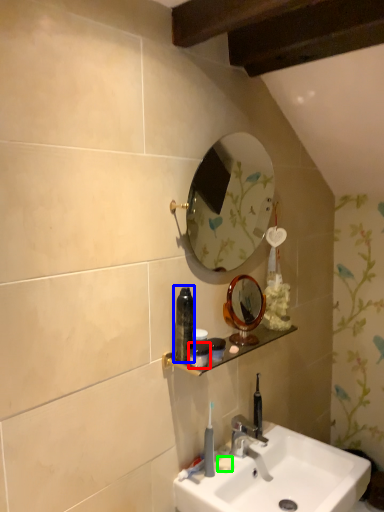
Question: Considering the real-world distances, which object is closest to mouthwash (highlighted by a red box)? mouthwash (highlighted by a blue box) or soap (highlighted by a green box).

Choices:
 (A) mouthwash
 (B) soap

Answer: (A)